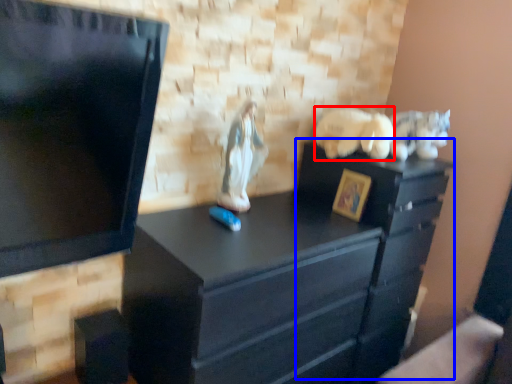
Question: Which of the following is the closest to the observer, animal (highlighted by a red box) or file cabinet (highlighted by a blue box)?

Choices:
 (A) animal
 (B) file cabinet

Answer: (B)